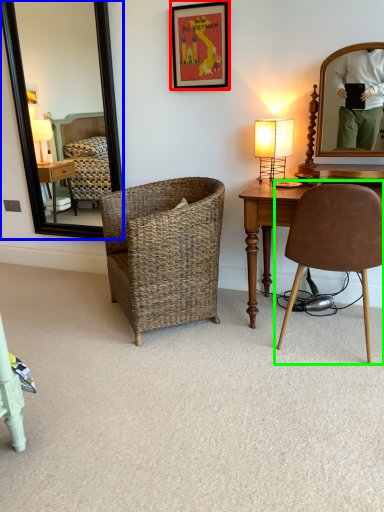
Question: Which object is positioned closest to picture frame (highlighted by a red box)? Select from mirror (highlighted by a blue box) and chair (highlighted by a green box).

Choices:
 (A) mirror
 (B) chair

Answer: (B)